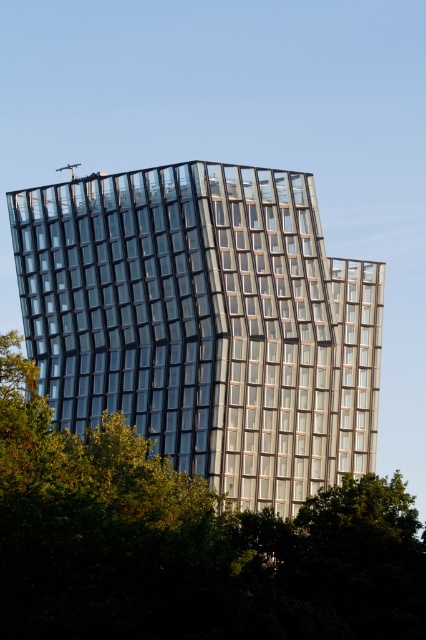
You are a drone operator planning to fly a drone between the glassy metallic building at center and the green leafy tree at center. The drone has a maximum flight distance of 20 meters. Based on the scene, can the drone safely complete this task?

The glassy metallic building at center is 23.73 meters from the green leafy tree at center. Since the distance exceeds the drone maximum flight distance of 20 meters, the drone cannot safely complete this task.

You are an architect analyzing the layout of the modern building. You notice the glassy metallic building at center and the green leafy tree at center. Which object is closer to the viewer?

The glassy metallic building at center is positioned over the green leafy tree at center, meaning it is closer to the viewer.

You are an architect evaluating the building design. Given that the glassy metallic building at center and the green leafy tree at center are both central to the composition, which one appears taller in the image?

The glassy metallic building at center appears taller than the green leafy tree at center as stated in the objects description.